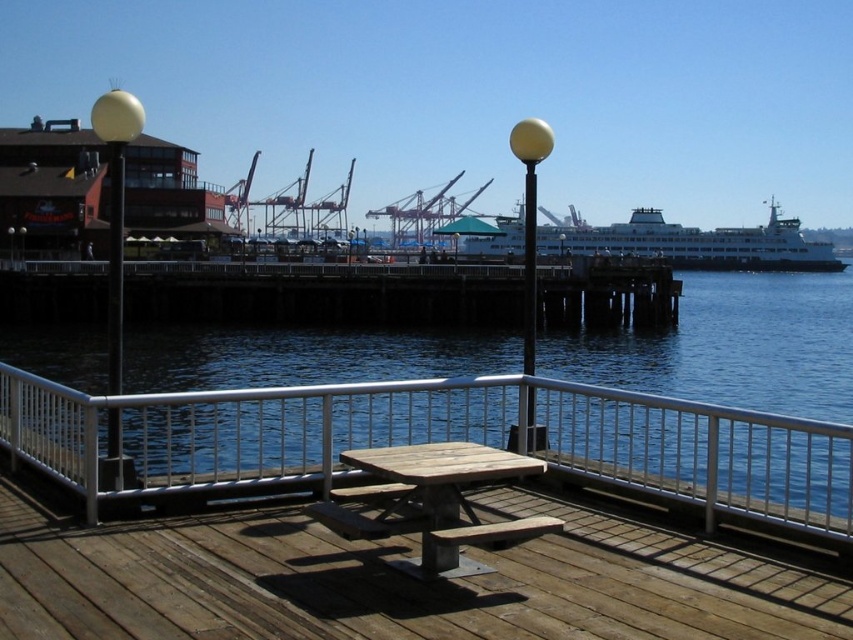
Question: Which point is closer to the camera taking this photo?

Choices:
 (A) (76, 442)
 (B) (776, 232)
 (C) (531, 317)

Answer: (A)

Question: Which is nearer to the white matte ferry at center?

Choices:
 (A) yellow glossy pole at center
 (B) yellow glass ball at center
 (C) matte yellow ball at left

Answer: (B)

Question: Does white matte ferry at center lie behind yellow glass ball at center?

Choices:
 (A) no
 (B) yes

Answer: (B)

Question: Considering the relative positions of white metal railing at center and matte yellow ball at left in the image provided, where is white metal railing at center located with respect to matte yellow ball at left?

Choices:
 (A) right
 (B) left

Answer: (A)

Question: Which object is positioned farthest from the yellow glass ball at center?

Choices:
 (A) yellow glossy pole at center
 (B) white metal railing at center
 (C) wooden picnic table at center

Answer: (B)

Question: Does metallic pole at left appear on the left side of yellow glossy pole at center?

Choices:
 (A) yes
 (B) no

Answer: (A)